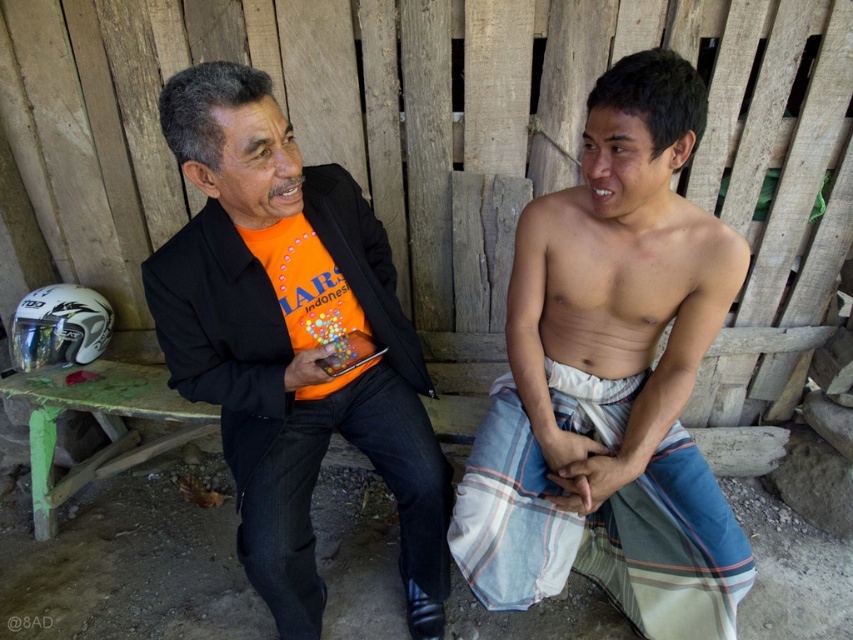
At what (x,y) coordinates should I click in order to perform the action: click on orange matte shirt at center. Please return your answer as a coordinate pair (x, y). This screenshot has height=640, width=853. Looking at the image, I should click on (291, 340).

Is orange matte shirt at center to the right of striped cotton sarong at lower center from the viewer's perspective?

No, orange matte shirt at center is not to the right of striped cotton sarong at lower center.

Does point (270, 224) come in front of point (525, 508)?

Yes.

Identify the location of orange matte shirt at center. (291, 340).

Does point (610, 230) come in front of point (526, 602)?

Yes, point (610, 230) is closer to viewer.

What do you see at coordinates (610, 380) in the screenshot? I see `striped cotton sarong at center` at bounding box center [610, 380].

Find the location of `striped cotton sarong at center`. striped cotton sarong at center is located at coordinates (610, 380).

Is striped cotton sarong at center taller than orange matte shirt at center?

Indeed, striped cotton sarong at center has a greater height compared to orange matte shirt at center.

Is point (646, 132) less distant than point (288, 470)?

That is True.

You are a GUI agent. You are given a task and a screenshot of the screen. Output one action in this format:
    pyautogui.click(x=<x>, y=<y>)
    Task: Click on the striped cotton sarong at center
    Image resolution: width=853 pixels, height=640 pixels.
    Given the screenshot: What is the action you would take?
    pyautogui.click(x=610, y=380)

Image resolution: width=853 pixels, height=640 pixels. Identify the location of striped cotton sarong at center. (610, 380).